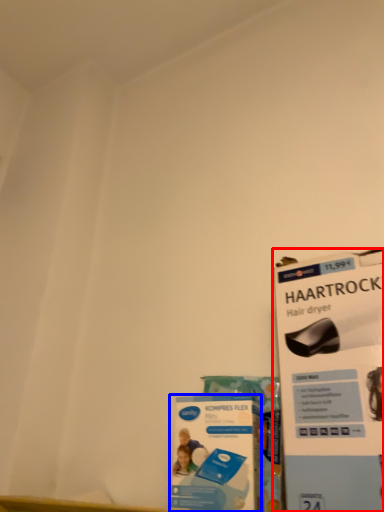
Question: Which object appears farthest to the camera in this image, magazine (highlighted by a red box) or flyer (highlighted by a blue box)?

Choices:
 (A) magazine
 (B) flyer

Answer: (B)